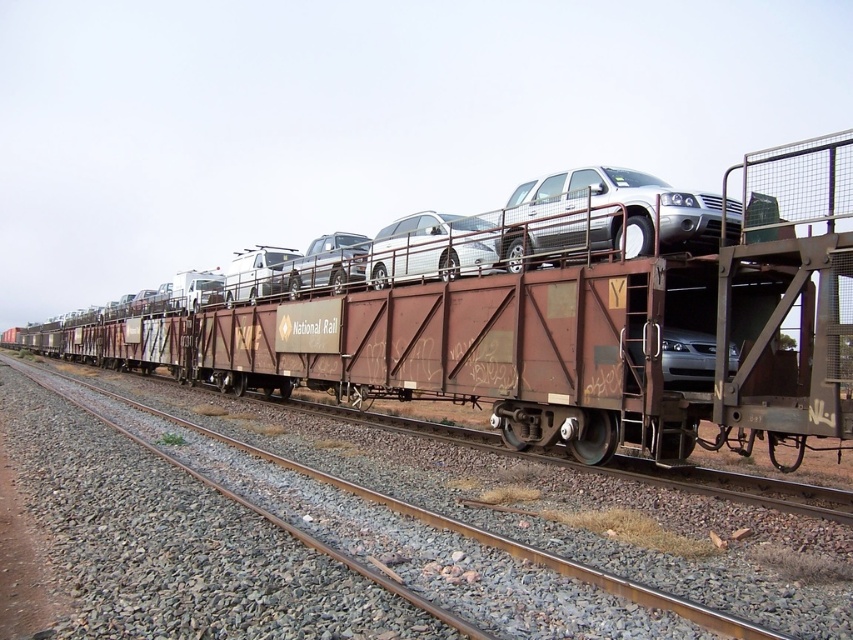
Question: Among these points, which one is farthest from the camera?

Choices:
 (A) (395, 221)
 (B) (451, 604)
 (C) (283, 260)

Answer: (C)

Question: Which point is closer to the camera taking this photo?

Choices:
 (A) (469, 609)
 (B) (463, 248)

Answer: (A)

Question: Is rusty metal train track at center positioned before rusty metal train car at center?

Choices:
 (A) no
 (B) yes

Answer: (B)

Question: Which object appears farthest from the camera in this image?

Choices:
 (A) rusty metal train track at center
 (B) silver metallic van at center

Answer: (B)

Question: Can you confirm if rusty metal train track at center is smaller than satin silver truck at center?

Choices:
 (A) yes
 (B) no

Answer: (B)

Question: Is rusty metal train car at center wider than silver metallic van at center?

Choices:
 (A) no
 (B) yes

Answer: (B)